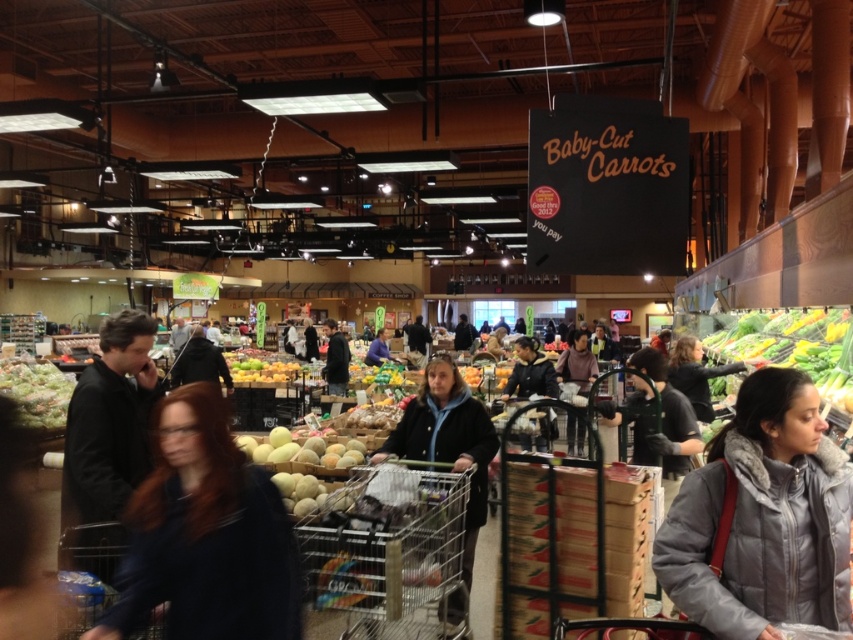
Based on the photo, is dark blue jacket at center above dark gray hoodie at center?

Incorrect, dark blue jacket at center is not positioned above dark gray hoodie at center.

Who is more distant from viewer, (x=438, y=404) or (x=331, y=344)?

The point (x=331, y=344) is more distant.

Which is behind, point (482, 422) or point (332, 355)?

Positioned behind is point (332, 355).

Locate an element on the screen. Image resolution: width=853 pixels, height=640 pixels. dark blue jacket at center is located at coordinates (448, 454).

Based on the photo, is dark blue sweater at center further to the viewer compared to dark blue jacket at center?

No, it is not.

Does dark blue sweater at center have a greater width compared to dark blue jacket at center?

Yes, dark blue sweater at center is wider than dark blue jacket at center.

Measure the distance between point (178, 627) and camera.

Point (178, 627) and camera are 2.34 meters apart from each other.

Image resolution: width=853 pixels, height=640 pixels. I want to click on dark blue sweater at center, so click(206, 534).

Who is lower down, metallic silver shopping cart at center or dark gray hoodie at center?

metallic silver shopping cart at center is below.

Based on the photo, is metallic silver shopping cart at center shorter than dark gray hoodie at center?

No, metallic silver shopping cart at center is not shorter than dark gray hoodie at center.

Which is behind, point (396, 554) or point (331, 385)?

The point (331, 385) is behind.

Find the location of `metallic silver shopping cart at center`. metallic silver shopping cart at center is located at coordinates (387, 548).